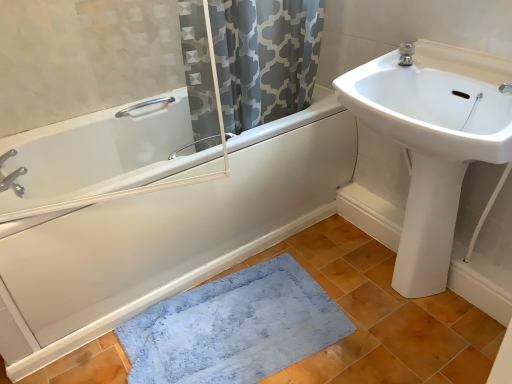
Question: From the image's perspective, is blue plush bath mat at lower center above white glossy bathtub at left?

Choices:
 (A) yes
 (B) no

Answer: (B)

Question: Considering the relative sizes of blue plush bath mat at lower center and white glossy bathtub at left in the image provided, is blue plush bath mat at lower center thinner than white glossy bathtub at left?

Choices:
 (A) yes
 (B) no

Answer: (A)

Question: Is blue plush bath mat at lower center far from white glossy bathtub at left?

Choices:
 (A) yes
 (B) no

Answer: (B)

Question: Does blue plush bath mat at lower center come in front of white glossy bathtub at left?

Choices:
 (A) yes
 (B) no

Answer: (B)

Question: Is blue plush bath mat at lower center wider than white glossy bathtub at left?

Choices:
 (A) yes
 (B) no

Answer: (B)

Question: From the image's perspective, is brushed metal faucet at upper left, which is the 2th tap in top-to-bottom order, located above or below satin nickel faucet at upper right, which is counted as the second tap, starting from the left?

Choices:
 (A) above
 (B) below

Answer: (B)

Question: Relative to satin nickel faucet at upper right, positioned as the 2th tap in bottom-to-top order, is brushed metal faucet at upper left, the first tap when ordered from left to right, in front or behind?

Choices:
 (A) behind
 (B) front

Answer: (A)

Question: Would you say brushed metal faucet at upper left, the 2th tap in the right-to-left sequence, is to the left or to the right of satin nickel faucet at upper right, positioned as the 2th tap in bottom-to-top order, in the picture?

Choices:
 (A) right
 (B) left

Answer: (B)

Question: From their relative heights in the image, would you say brushed metal faucet at upper left, which is the 2th tap in top-to-bottom order, is taller or shorter than satin nickel faucet at upper right, positioned as the 2th tap in bottom-to-top order?

Choices:
 (A) tall
 (B) short

Answer: (A)

Question: From the image's perspective, is gray printed fabric at upper center above or below brushed metal faucet at upper left, which is the 2th tap in top-to-bottom order?

Choices:
 (A) below
 (B) above

Answer: (B)

Question: Relative to brushed metal faucet at upper left, the first tap when ordered from left to right, is gray printed fabric at upper center in front or behind?

Choices:
 (A) front
 (B) behind

Answer: (A)

Question: Would you say gray printed fabric at upper center is to the left or to the right of brushed metal faucet at upper left, the 2th tap in the right-to-left sequence, in the picture?

Choices:
 (A) left
 (B) right

Answer: (B)

Question: From their relative heights in the image, would you say gray printed fabric at upper center is taller or shorter than brushed metal faucet at upper left, the first tap when ordered from left to right?

Choices:
 (A) tall
 (B) short

Answer: (A)

Question: From a real-world perspective, is blue plush bath mat at lower center positioned above or below white glossy sink at upper right?

Choices:
 (A) below
 (B) above

Answer: (A)

Question: Looking at their shapes, would you say blue plush bath mat at lower center is wider or thinner than white glossy sink at upper right?

Choices:
 (A) wide
 (B) thin

Answer: (A)